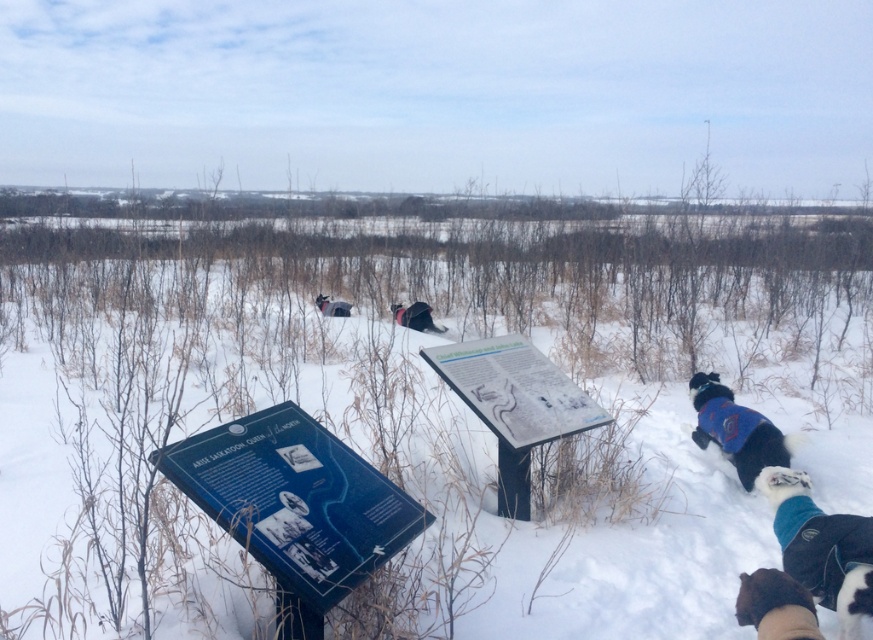
You are a photographer trying to capture the white fluffy snow at center and the white fur dog at lower right in the same frame. Based on their sizes, which one should you focus on first to ensure both are in focus?

The white fluffy snow at center is bigger than the white fur dog at lower right, so you should focus on the white fluffy snow at center first to ensure both are in focus.

You are a photographer standing at the edge of the snowy field. You want to take a photo that includes both the blue fleece jacket at lower right and the brown fur coat at lower right. Given that your camera has a maximum focus range of 2 meters, will you be able to capture both subjects in focus?

The distance between the blue fleece jacket at lower right and the brown fur coat at lower right is 1.97 meters, which is within the camera maximum focus range of 2 meters. Therefore, both subjects can be captured in focus.

You are standing in the winter landscape and want to walk from the white fluffy snow at center to the white fur dog at lower right. Which direction should you move to reach the dog?

The white fluffy snow at center is located above the white fur dog at lower right, so you should move downward to reach the dog.